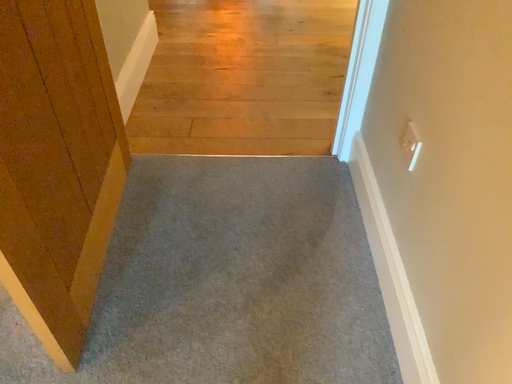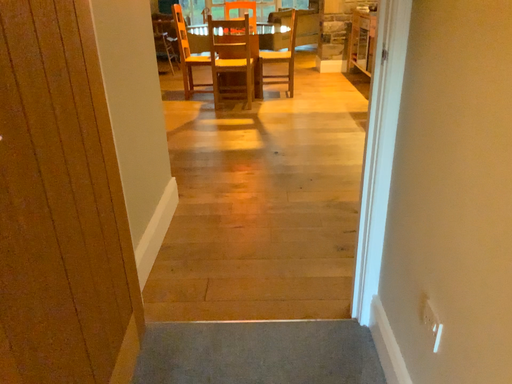
Question: How did the camera likely rotate when shooting the video?

Choices:
 (A) rotated upward
 (B) rotated downward

Answer: (A)